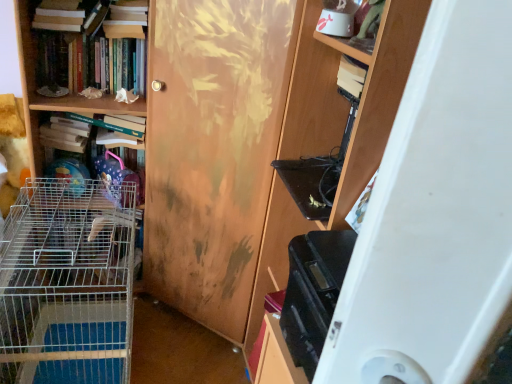
Question: Is wooden door at center aimed at wooden shelf at right?

Choices:
 (A) no
 (B) yes

Answer: (A)

Question: Is wooden shelf at right at the back of wooden door at center?

Choices:
 (A) no
 (B) yes

Answer: (A)

Question: Does wooden door at center have a greater width compared to wooden shelf at right?

Choices:
 (A) yes
 (B) no

Answer: (A)

Question: Does wooden door at center have a smaller size compared to wooden shelf at right?

Choices:
 (A) no
 (B) yes

Answer: (A)

Question: Is wooden door at center surrounding wooden shelf at right?

Choices:
 (A) no
 (B) yes

Answer: (A)

Question: Is the position of wooden door at center less distant than that of wooden shelf at right?

Choices:
 (A) no
 (B) yes

Answer: (A)

Question: Considering the relative sizes of hardcover books at upper left, positioned as the 2th book in bottom-to-top order, and silver wire cage at left in the image provided, is hardcover books at upper left, positioned as the 2th book in bottom-to-top order, thinner than silver wire cage at left?

Choices:
 (A) no
 (B) yes

Answer: (B)

Question: From the image's perspective, is hardcover books at upper left, positioned as the 2th book in bottom-to-top order, on silver wire cage at left?

Choices:
 (A) yes
 (B) no

Answer: (A)

Question: From a real-world perspective, does hardcover books at upper left, which is the 2th book from top to bottom, sit lower than silver wire cage at left?

Choices:
 (A) yes
 (B) no

Answer: (B)

Question: Can you confirm if hardcover books at upper left, which is the 2th book from top to bottom, is taller than silver wire cage at left?

Choices:
 (A) yes
 (B) no

Answer: (B)

Question: From a real-world perspective, does hardcover books at upper left, which is the 2th book from top to bottom, stand above silver wire cage at left?

Choices:
 (A) no
 (B) yes

Answer: (B)

Question: Is hardcover books at upper left, which is the 2th book from top to bottom, at the right side of silver wire cage at left?

Choices:
 (A) yes
 (B) no

Answer: (B)

Question: From a real-world perspective, is hardcover books at upper left, positioned as the 2th book in bottom-to-top order, over wooden door at center?

Choices:
 (A) yes
 (B) no

Answer: (A)